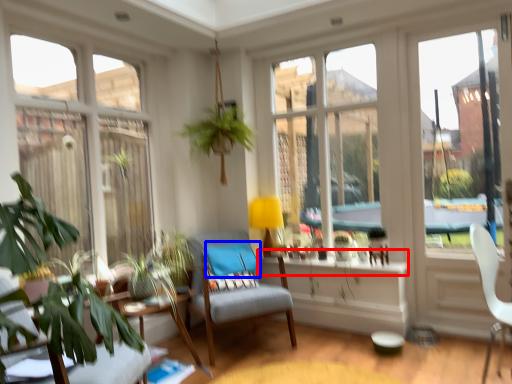
Question: Which object is further to the camera taking this photo, window sill (highlighted by a red box) or pillow (highlighted by a blue box)?

Choices:
 (A) window sill
 (B) pillow

Answer: (B)